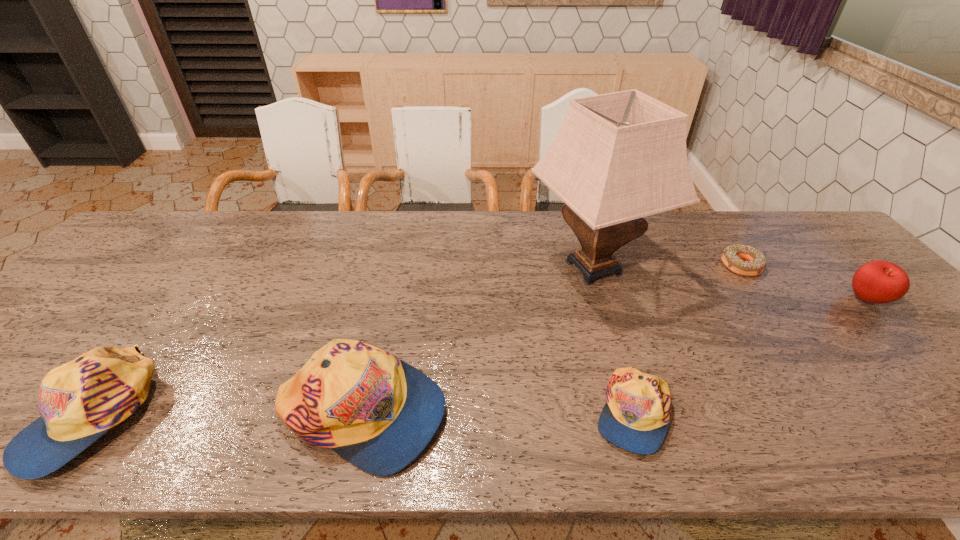
You are a GUI agent. You are given a task and a screenshot of the screen. Output one action in this format:
    pyautogui.click(x=<x>, y=<y>)
    Task: Click on the free location located on the back of the apple
    The width and height of the screenshot is (960, 540).
    Given the screenshot: What is the action you would take?
    pyautogui.click(x=788, y=218)

You are a GUI agent. You are given a task and a screenshot of the screen. Output one action in this format:
    pyautogui.click(x=<x>, y=<y>)
    Task: Click on the lampshade present at the far edge
    
    Given the screenshot: What is the action you would take?
    pyautogui.click(x=618, y=157)

Locate an element on the screen. Image resolution: width=960 pixels, height=540 pixels. doughnut that is positioned at the far edge is located at coordinates (732, 256).

Where is `object that is at the right edge`? This screenshot has height=540, width=960. object that is at the right edge is located at coordinates [x=878, y=282].

The height and width of the screenshot is (540, 960). Find the location of `vacant point at the far edge`. vacant point at the far edge is located at coordinates (732, 231).

Locate an element on the screen. free space at the near edge of the desktop is located at coordinates (568, 401).

In the image, there is a desktop. Where is `vacant space at the left edge`? vacant space at the left edge is located at coordinates tap(70, 315).

Locate an element on the screen. vacant region at the right edge of the desktop is located at coordinates (849, 261).

Where is `vacant space at the far left corner of the desktop`? vacant space at the far left corner of the desktop is located at coordinates (188, 231).

Where is `free area in between the rightmost object and the lampshade`? free area in between the rightmost object and the lampshade is located at coordinates (730, 284).